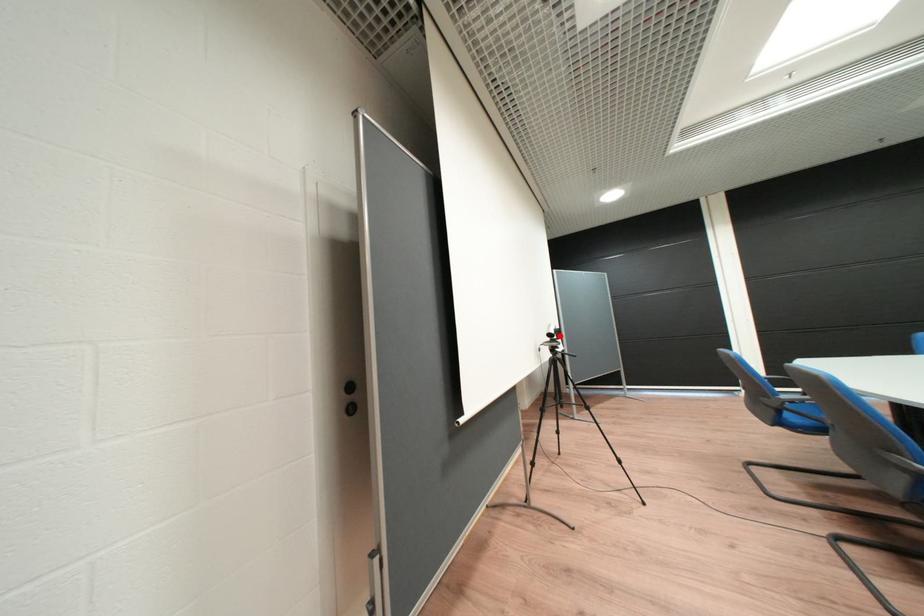
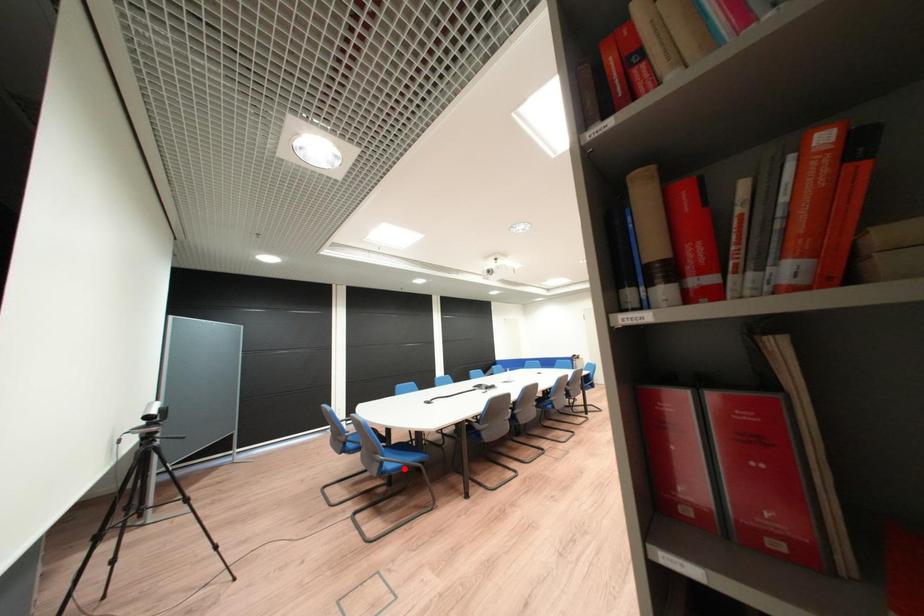
I am providing you with two images of the same scene from different viewpoints. A red point is marked on the first image and another point is marked on the second image. Is the red point in image1 aligned with the point shown in image2?

No